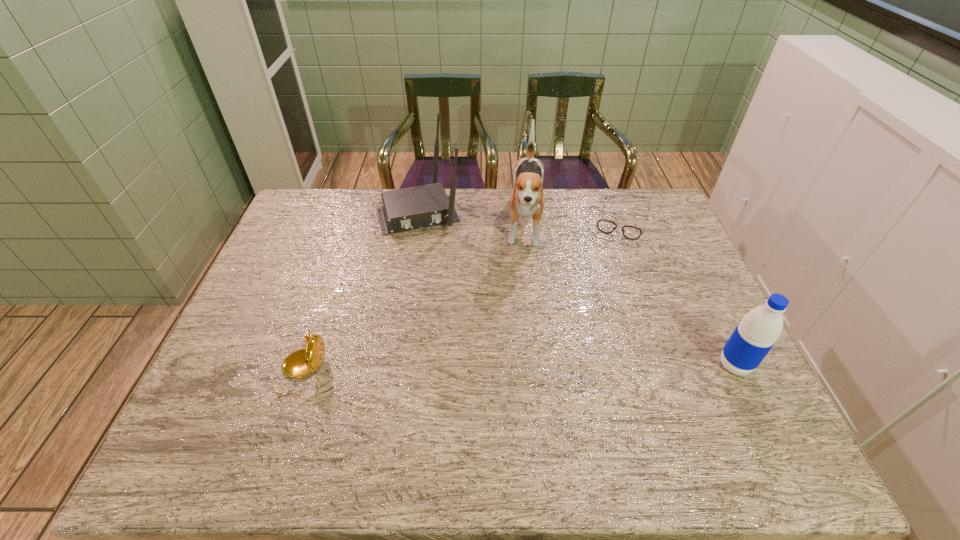
Find the location of a particular element. sunglasses that is at the far edge is located at coordinates (605, 226).

The width and height of the screenshot is (960, 540). In order to click on puppy that is at the far edge in this screenshot , I will do `click(527, 198)`.

Find the location of `router that is at the far edge`. router that is at the far edge is located at coordinates (405, 209).

The image size is (960, 540). Identify the location of object situated at the near edge. (300, 363).

Image resolution: width=960 pixels, height=540 pixels. I want to click on water bottle present at the right edge, so click(x=758, y=331).

Image resolution: width=960 pixels, height=540 pixels. In order to click on sunglasses present at the right edge in this screenshot , I will do `click(605, 226)`.

Identify the location of object that is at the far right corner. (605, 226).

Where is `free space at the far edge of the desktop`? The width and height of the screenshot is (960, 540). free space at the far edge of the desktop is located at coordinates point(585,222).

At what (x,y) coordinates should I click in order to perform the action: click on free spot at the near edge of the desktop. Please return your answer as a coordinate pair (x, y). The image size is (960, 540). Looking at the image, I should click on (406, 393).

What are the coordinates of `free space at the left edge of the desktop` in the screenshot? It's located at (320, 260).